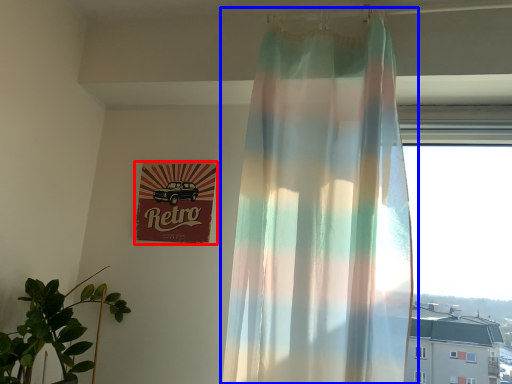
Question: Which object is closer to the camera taking this photo, signage (highlighted by a red box) or curtain (highlighted by a blue box)?

Choices:
 (A) signage
 (B) curtain

Answer: (B)